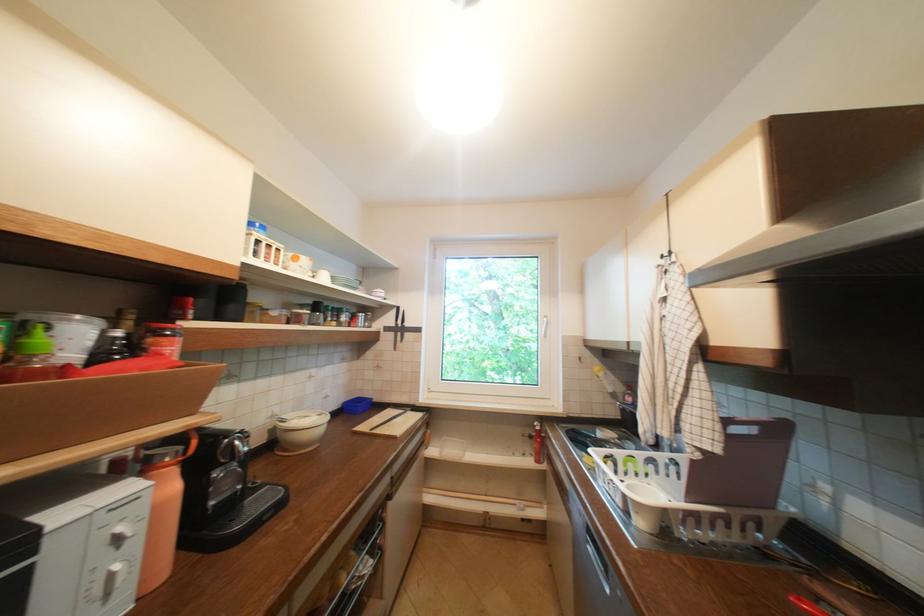
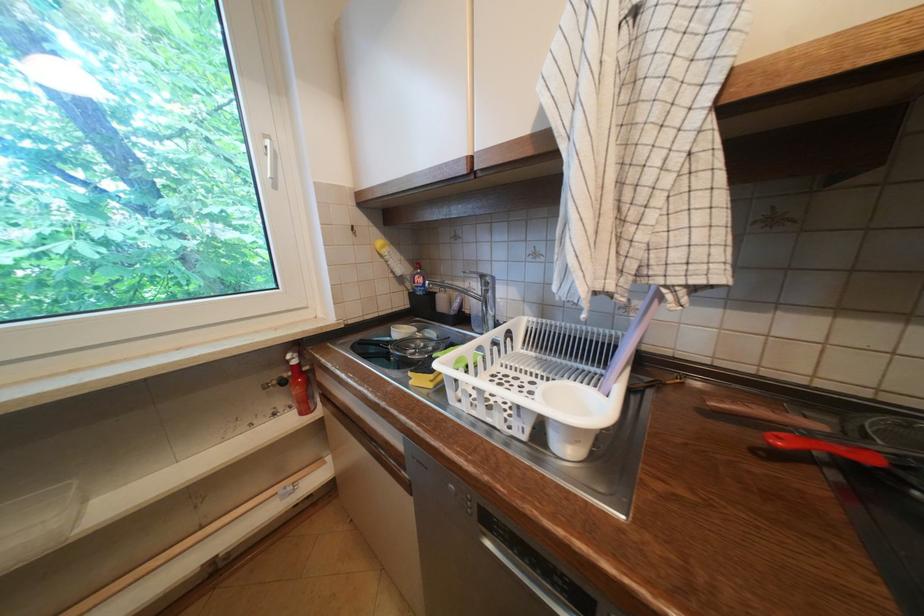
Where in the second image is the point corresponding to [542,427] from the first image?

(296, 362)